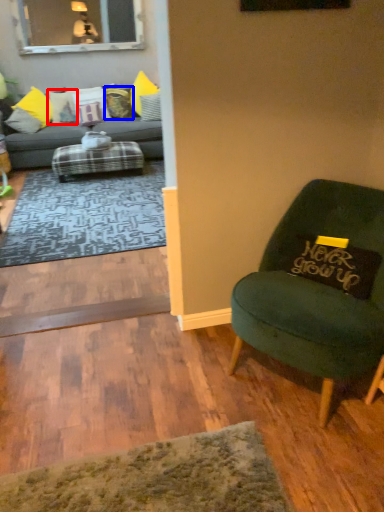
Question: Which of the following is the closest to the observer, pillow (highlighted by a red box) or pillow (highlighted by a blue box)?

Choices:
 (A) pillow
 (B) pillow

Answer: (A)